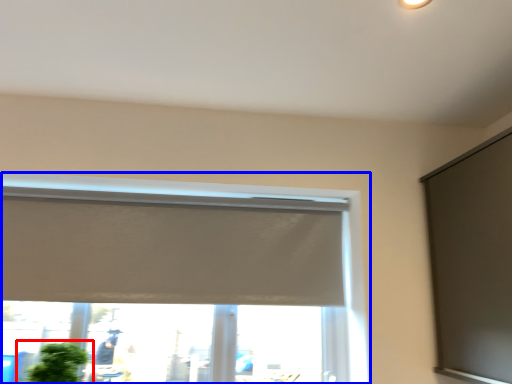
Question: Which object is closer to the camera taking this photo, houseplant (highlighted by a red box) or window (highlighted by a blue box)?

Choices:
 (A) houseplant
 (B) window

Answer: (A)